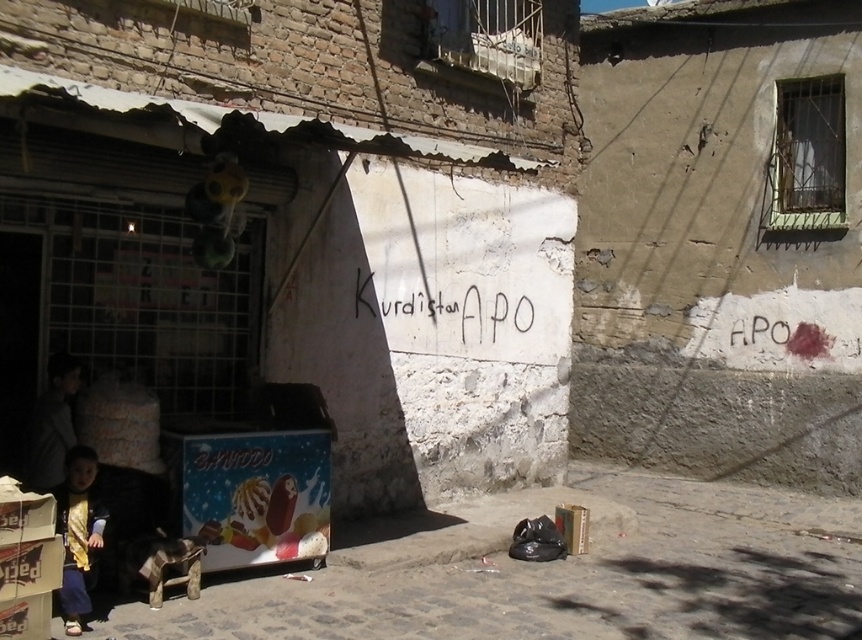
Between black painted graffiti at center and dark gray jacket at lower left, which one has more height?

dark gray jacket at lower left

Can you confirm if black painted graffiti at center is shorter than dark gray jacket at lower left?

Yes, black painted graffiti at center is shorter than dark gray jacket at lower left.

Is point (411, 346) positioned in front of point (51, 378)?

No, it is behind (51, 378).

What are the coordinates of `black painted graffiti at center` in the screenshot? It's located at (447, 314).

Who is positioned more to the right, cardboard ice cream stand at lower left or black painted graffiti at center?

From the viewer's perspective, cardboard ice cream stand at lower left appears more on the right side.

Is cardboard ice cream stand at lower left smaller than black painted graffiti at center?

Correct, cardboard ice cream stand at lower left occupies less space than black painted graffiti at center.

Who is more forward, (503, 576) or (436, 317)?

Point (503, 576) is in front.

This screenshot has width=862, height=640. Find the location of `cardboard ice cream stand at lower left`. cardboard ice cream stand at lower left is located at coordinates [569, 580].

Between cardboard ice cream stand at lower left and dark gray jacket at lower left, which one has less height?

With less height is cardboard ice cream stand at lower left.

Between cardboard ice cream stand at lower left and dark gray jacket at lower left, which one is positioned higher?

dark gray jacket at lower left is above.

Is point (378, 570) positioned in front of point (54, 353)?

No, (378, 570) is further to viewer.

Identify the location of cardboard ice cream stand at lower left. The image size is (862, 640). (569, 580).